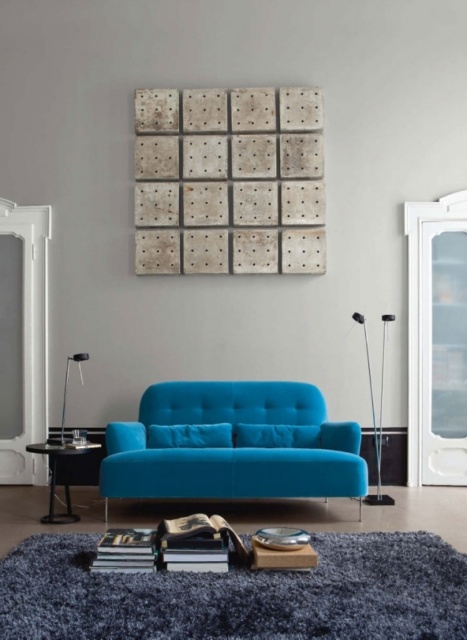
You are planning to place a new rectangular rug in the living room. The rug must be placed between the teal velvet sofa at center and the matte black side table at lower left. Given that the sofa is wider than the side table, which object should the rug be centered around to ensure it accommodates both?

The rug should be centered around the teal velvet sofa at center since it is wider than the matte black side table at lower left, ensuring the rug can accommodate both objects.

You are a guest entering the living room and want to sit on the teal velvet sofa at center. To do so, you need to walk past the matte black side table at lower left. Considering their heights, will you be able to see the sofa over the side table from your current position?

The teal velvet sofa at center is taller than the matte black side table at lower left, so yes, you will be able to see the sofa over the side table from your current position.

You are standing in the living room and want to hang a new picture between the two points, point [235,456] and point [49,512]. Which point should you place the picture closer to so it appears larger to someone sitting on the turquoise sofa?

You should place the picture closer to point [235,456] because it is closer to the viewer, making the picture appear larger when viewed from the turquoise sofa.